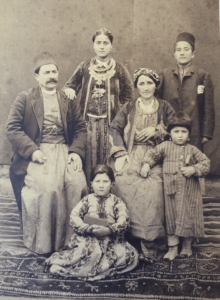
Locate an element on the screen. The width and height of the screenshot is (220, 300). carpet is located at coordinates (153, 280).